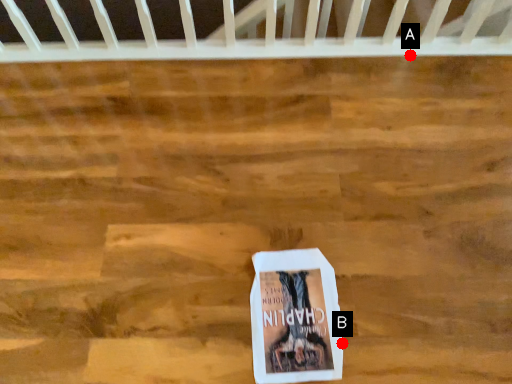
Question: Two points are circled on the image, labeled by A and B beside each circle. Which point is farther to the camera?

Choices:
 (A) A is further
 (B) B is further

Answer: (A)